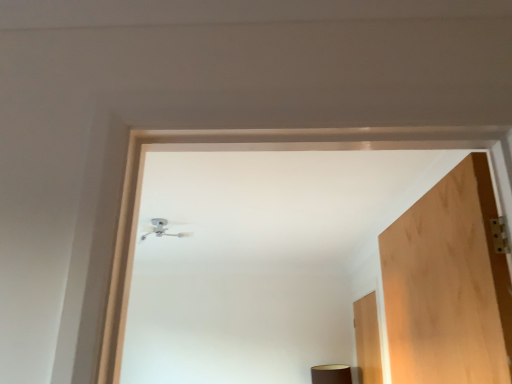
Question: Is wooden door at right facing away from white metallic ceiling light at upper center?

Choices:
 (A) no
 (B) yes

Answer: (A)

Question: From a real-world perspective, is wooden door at right positioned over white metallic ceiling light at upper center based on gravity?

Choices:
 (A) no
 (B) yes

Answer: (A)

Question: From the image's perspective, would you say wooden door at right is shown under white metallic ceiling light at upper center?

Choices:
 (A) no
 (B) yes

Answer: (B)

Question: Is the position of wooden door at right less distant than that of white metallic ceiling light at upper center?

Choices:
 (A) no
 (B) yes

Answer: (A)

Question: Can you confirm if wooden door at right is thinner than white metallic ceiling light at upper center?

Choices:
 (A) no
 (B) yes

Answer: (B)

Question: From a real-world perspective, is wooden door at right physically below white metallic ceiling light at upper center?

Choices:
 (A) yes
 (B) no

Answer: (A)

Question: Is white metallic ceiling light at upper center to the left of wooden door at right from the viewer's perspective?

Choices:
 (A) no
 (B) yes

Answer: (B)

Question: From a real-world perspective, does white metallic ceiling light at upper center stand above wooden door at right?

Choices:
 (A) no
 (B) yes

Answer: (B)

Question: Is white metallic ceiling light at upper center positioned behind wooden door at right?

Choices:
 (A) no
 (B) yes

Answer: (A)

Question: Can you confirm if white metallic ceiling light at upper center is smaller than wooden door at right?

Choices:
 (A) no
 (B) yes

Answer: (B)

Question: Is white metallic ceiling light at upper center at the right side of wooden door at right?

Choices:
 (A) no
 (B) yes

Answer: (A)

Question: Is white metallic ceiling light at upper center wider than wooden door at right?

Choices:
 (A) no
 (B) yes

Answer: (B)

Question: From their relative heights in the image, would you say wooden door at right is taller or shorter than white metallic ceiling light at upper center?

Choices:
 (A) tall
 (B) short

Answer: (A)